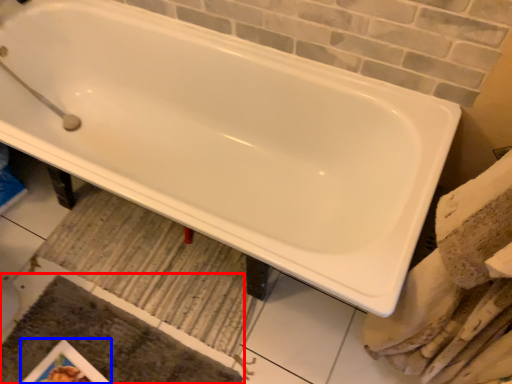
Question: Which object appears closest to the camera in this image, bath mat (highlighted by a red box) or magazine (highlighted by a blue box)?

Choices:
 (A) bath mat
 (B) magazine

Answer: (A)